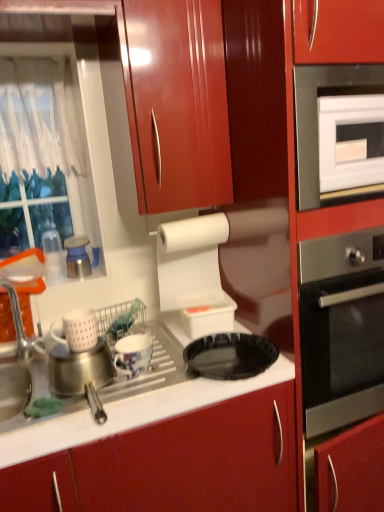
Find the location of a particular element. The image size is (384, 512). white matte mug at left, which is the 3th appliance from left to right is located at coordinates point(80,329).

Looking at this image, measure the distance between black glossy plate at center and camera.

The depth of black glossy plate at center is 3.88 feet.

Describe the element at coordinates (317, 114) in the screenshot. The height and width of the screenshot is (512, 384). I see `white glossy oven at upper right` at that location.

Describe the element at coordinates (43, 407) in the screenshot. The height and width of the screenshot is (512, 384). I see `green sponge at sink` at that location.

Locate an element on the screen. white matte mug at left, which is the 3th appliance from left to right is located at coordinates pos(80,329).

Considering the positions of objects porcelain floral mug at center, the 2th appliance from the right, and metallic blue and white kettle at left, which is the 4th appliance from right to left, in the image provided, who is in front, porcelain floral mug at center, the 2th appliance from the right, or metallic blue and white kettle at left, which is the 4th appliance from right to left,?

porcelain floral mug at center, the 2th appliance from the right, is closer to the camera.

Could you tell me if porcelain floral mug at center, which is the fourth appliance in left-to-right order, is turned towards metallic blue and white kettle at left, which is the 4th appliance from right to left?

No.

Which of these two, porcelain floral mug at center, which is the fourth appliance in left-to-right order, or metallic blue and white kettle at left, which is the 4th appliance from right to left, is wider?

Wider between the two is porcelain floral mug at center, which is the fourth appliance in left-to-right order.

Is green sponge at sink aimed at black glossy plate at center?

No, green sponge at sink is not oriented towards black glossy plate at center.

Is green sponge at sink positioned far away from black glossy plate at center?

No, green sponge at sink is not far away from black glossy plate at center.

What's the angular difference between green sponge at sink and black glossy plate at center's facing directions?

The angle between the facing direction of green sponge at sink and the facing direction of black glossy plate at center is 0.226 degrees.

Based on their positions, is green sponge at sink located to the left or right of black glossy plate at center?

From the image, it's evident that green sponge at sink is to the left of black glossy plate at center.

Based on the photo, is porcelain floral mug at center, the 2th appliance from the right, not inside clear plastic cups at left, which appears as the 5th appliance when viewed from the right?

Yes, porcelain floral mug at center, the 2th appliance from the right, is not within clear plastic cups at left, which appears as the 5th appliance when viewed from the right.

Where is `the 2nd appliance behind the porcelain floral mug at center, the 2th appliance from the right, counting from the anchor's position`? The image size is (384, 512). the 2nd appliance behind the porcelain floral mug at center, the 2th appliance from the right, counting from the anchor's position is located at coordinates (52, 256).

From the image's perspective, does porcelain floral mug at center, which is the fourth appliance in left-to-right order, appear lower than clear plastic cups at left, marked as the 1th appliance in a left-to-right arrangement?

Indeed, from the image's perspective, porcelain floral mug at center, which is the fourth appliance in left-to-right order, is shown beneath clear plastic cups at left, marked as the 1th appliance in a left-to-right arrangement.

Is porcelain floral mug at center, the 2th appliance from the right, at the right side of clear plastic cups at left, which appears as the 5th appliance when viewed from the right?

Yes, porcelain floral mug at center, the 2th appliance from the right, is to the right of clear plastic cups at left, which appears as the 5th appliance when viewed from the right.

Is metallic blue and white kettle at left, which is the 4th appliance from right to left, looking in the opposite direction of white matte mug at left, which is the 3th appliance from left to right?

metallic blue and white kettle at left, which is the 4th appliance from right to left, is not turned away from white matte mug at left, which is the 3th appliance from left to right.

Measure the distance from metallic blue and white kettle at left, which is the 2th appliance from left to right, to white matte mug at left, which is the 3th appliance from left to right.

metallic blue and white kettle at left, which is the 2th appliance from left to right, and white matte mug at left, which is the 3th appliance from left to right, are 44.61 centimeters apart from each other.

Considering the sizes of objects metallic blue and white kettle at left, which is the 2th appliance from left to right, and white matte mug at left, which is the 3th appliance from left to right, in the image provided, who is bigger, metallic blue and white kettle at left, which is the 2th appliance from left to right, or white matte mug at left, which is the 3th appliance from left to right,?

With larger size is metallic blue and white kettle at left, which is the 2th appliance from left to right.

From the image's perspective, is metallic blue and white kettle at left, which is the 4th appliance from right to left, beneath white glossy oven at upper right?

Yes.

Is metallic blue and white kettle at left, which is the 4th appliance from right to left, far away from white glossy oven at upper right?

No, metallic blue and white kettle at left, which is the 4th appliance from right to left, is not far from white glossy oven at upper right.

Does metallic blue and white kettle at left, which is the 4th appliance from right to left, appear on the right side of white glossy oven at upper right?

In fact, metallic blue and white kettle at left, which is the 4th appliance from right to left, is to the left of white glossy oven at upper right.

Could you tell me if white matte mug at left, which is the 3th appliance from right to left, is facing porcelain floral mug at center, which is the fourth appliance in left-to-right order?

No, white matte mug at left, which is the 3th appliance from right to left, is not oriented towards porcelain floral mug at center, which is the fourth appliance in left-to-right order.

Based on the photo, what's the angular difference between white matte mug at left, which is the 3th appliance from left to right, and porcelain floral mug at center, which is the fourth appliance in left-to-right order,'s facing directions?

The angular difference between white matte mug at left, which is the 3th appliance from left to right, and porcelain floral mug at center, which is the fourth appliance in left-to-right order, is 0.469 degrees.

In the scene shown: Is white matte mug at left, which is the 3th appliance from right to left, smaller than porcelain floral mug at center, which is the fourth appliance in left-to-right order?

Correct, white matte mug at left, which is the 3th appliance from right to left, occupies less space than porcelain floral mug at center, which is the fourth appliance in left-to-right order.

Which is in front, white matte mug at left, which is the 3th appliance from right to left, or porcelain floral mug at center, which is the fourth appliance in left-to-right order?

white matte mug at left, which is the 3th appliance from right to left.

Can you confirm if clear plastic cups at left, which appears as the 5th appliance when viewed from the right, is positioned to the left of white matte mug at left, which is the 3th appliance from right to left?

Yes.

Is clear plastic cups at left, which appears as the 5th appliance when viewed from the right, in front of or behind white matte mug at left, which is the 3th appliance from right to left, in the image?

clear plastic cups at left, which appears as the 5th appliance when viewed from the right, is positioned farther from the viewer than white matte mug at left, which is the 3th appliance from right to left.

Considering the sizes of objects clear plastic cups at left, marked as the 1th appliance in a left-to-right arrangement, and white matte mug at left, which is the 3th appliance from right to left, in the image provided, who is smaller, clear plastic cups at left, marked as the 1th appliance in a left-to-right arrangement, or white matte mug at left, which is the 3th appliance from right to left,?

With smaller size is white matte mug at left, which is the 3th appliance from right to left.

Does clear plastic cups at left, marked as the 1th appliance in a left-to-right arrangement, have a greater width compared to white matte mug at left, which is the 3th appliance from right to left?

Incorrect, the width of clear plastic cups at left, marked as the 1th appliance in a left-to-right arrangement, does not surpass that of white matte mug at left, which is the 3th appliance from right to left.

Locate an element on the screen. The image size is (384, 512). the 3rd appliance positioned above the porcelain floral mug at center, the 2th appliance from the right (from a real-world perspective) is located at coordinates (77, 256).

This screenshot has width=384, height=512. I want to click on food that is under the black glossy plate at center (from a real-world perspective), so click(43, 407).

Estimate the real-world distances between objects in this image. Which object is further from white plastic container at upper center, which is the fifth appliance in left-to-right order, metallic blue and white kettle at left, which is the 4th appliance from right to left, or white glossy oven at upper right?

Based on the image, white glossy oven at upper right appears to be further to white plastic container at upper center, which is the fifth appliance in left-to-right order.

From the image, which object appears to be nearer to white matte mug at left, which is the 3th appliance from left to right, porcelain floral mug at center, which is the fourth appliance in left-to-right order, or white plastic container at upper center, which is the fifth appliance in left-to-right order?

Among the two, porcelain floral mug at center, which is the fourth appliance in left-to-right order, is located nearer to white matte mug at left, which is the 3th appliance from left to right.

Considering their positions, is black glossy plate at center positioned further to clear plastic cups at left, which appears as the 5th appliance when viewed from the right, than porcelain floral mug at center, the 2th appliance from the right?

A: Among the two, black glossy plate at center is located further to clear plastic cups at left, which appears as the 5th appliance when viewed from the right.

Which object lies further to the anchor point white matte mug at left, which is the 3th appliance from right to left, green sponge at sink or clear plastic cups at left, which appears as the 5th appliance when viewed from the right?

clear plastic cups at left, which appears as the 5th appliance when viewed from the right, is further to white matte mug at left, which is the 3th appliance from right to left.

Considering their positions, is green sponge at sink positioned closer to black glossy plate at center than white plastic container at upper center, the first appliance positioned from the right?

white plastic container at upper center, the first appliance positioned from the right, lies closer to black glossy plate at center than the other object.

From the image, which object appears to be nearer to green sponge at sink, white plastic container at upper center, which is the fifth appliance in left-to-right order, or black glossy plate at center?

black glossy plate at center.

Looking at the image, which one is located closer to clear plastic cups at left, marked as the 1th appliance in a left-to-right arrangement, white matte mug at left, which is the 3th appliance from right to left, or green sponge at sink?

white matte mug at left, which is the 3th appliance from right to left, is closer to clear plastic cups at left, marked as the 1th appliance in a left-to-right arrangement.

Estimate the real-world distances between objects in this image. Which object is further from white plastic container at upper center, which is the fifth appliance in left-to-right order, black glossy plate at center or white matte mug at left, which is the 3th appliance from left to right?

white matte mug at left, which is the 3th appliance from left to right.

The height and width of the screenshot is (512, 384). I want to click on gas stove between white matte mug at left, which is the 3th appliance from left to right, and white glossy oven at upper right from left to right, so click(x=230, y=356).

At what (x,y) coordinates should I click in order to perform the action: click on food between clear plastic cups at left, marked as the 1th appliance in a left-to-right arrangement, and black glossy plate at center from left to right. Please return your answer as a coordinate pair (x, y). Image resolution: width=384 pixels, height=512 pixels. Looking at the image, I should click on click(x=43, y=407).

At what (x,y) coordinates should I click in order to perform the action: click on food between clear plastic cups at left, marked as the 1th appliance in a left-to-right arrangement, and white plastic container at upper center, which is the fifth appliance in left-to-right order. Please return your answer as a coordinate pair (x, y). The width and height of the screenshot is (384, 512). Looking at the image, I should click on (43, 407).

Identify the location of gas stove between green sponge at sink and white glossy oven at upper right in the horizontal direction. This screenshot has height=512, width=384. (230, 356).